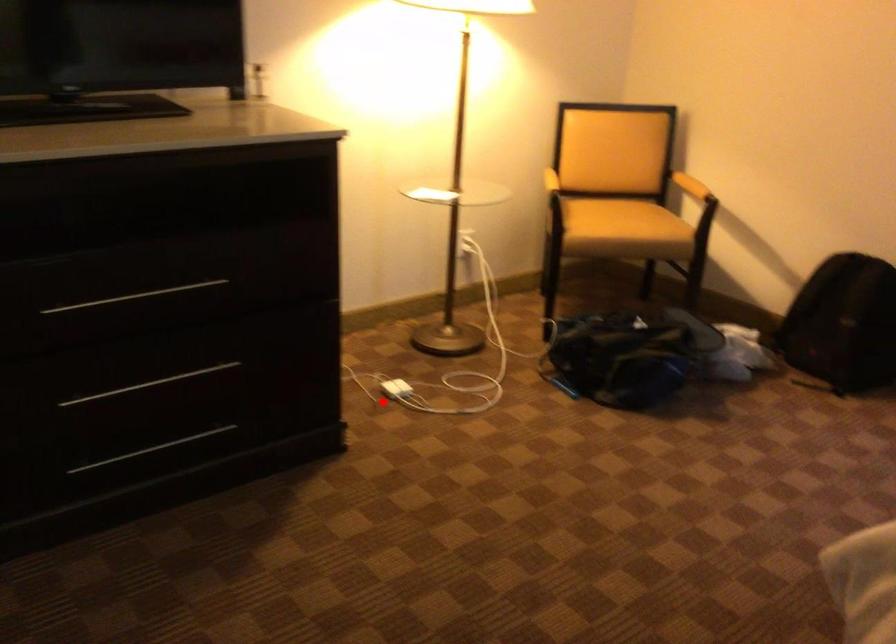
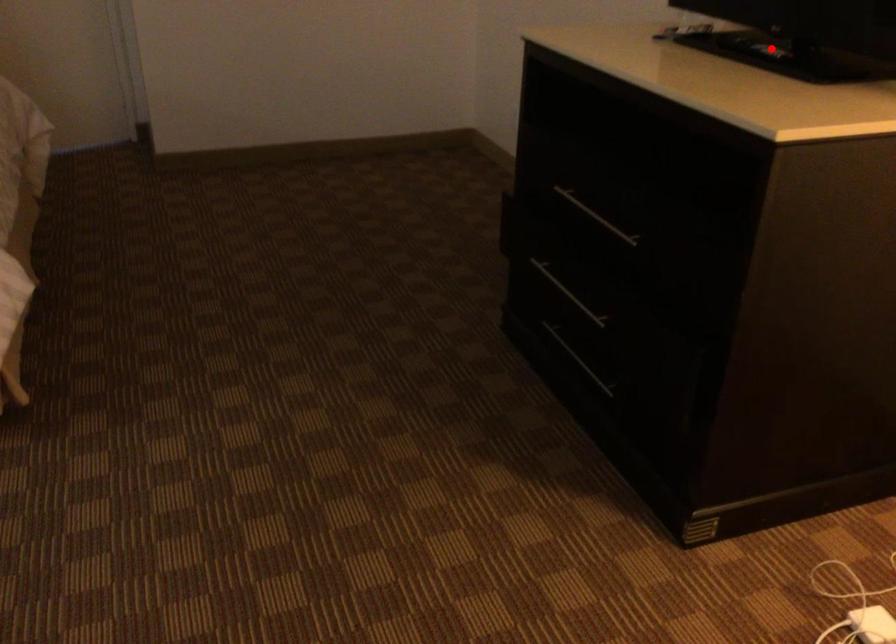
I am providing you with two images of the same scene from different viewpoints. A red point is marked on the first image and another point is marked on the second image. Are the points marked in image1 and image2 representing the same 3D position?

No